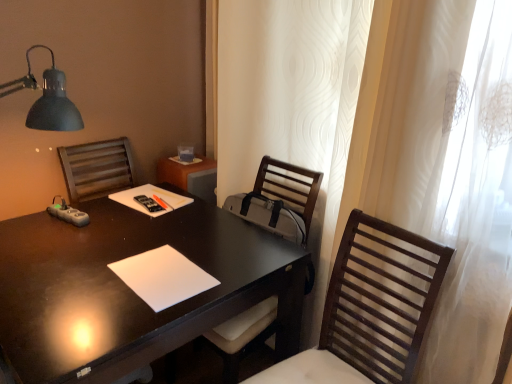
Question: From a real-world perspective, is wooden chair at center, positioned as the 2th chair in front-to-back order, above or below wooden slats chair at right, marked as the first chair in a front-to-back arrangement?

Choices:
 (A) above
 (B) below

Answer: (B)

Question: From the image's perspective, is wooden chair at center, positioned as the 2th chair in front-to-back order, located above or below wooden slats chair at right, which is the 2th chair in back-to-front order?

Choices:
 (A) above
 (B) below

Answer: (A)

Question: Which object is positioned closest to the wooden slats chair at right, which is the 2th chair in back-to-front order?

Choices:
 (A) white sheer curtain at right
 (B) black glossy desk at center
 (C) white matte notepad at center
 (D) wooden chair at center, positioned as the 2th chair in front-to-back order
 (E) black plastic remote control at center

Answer: (A)

Question: Estimate the real-world distances between objects in this image. Which object is closer to the wooden chair at center, which ranks as the first chair in back-to-front order?

Choices:
 (A) black plastic remote control at center
 (B) white matte notepad at center
 (C) black glossy desk at center
 (D) wooden slats chair at right, marked as the first chair in a front-to-back arrangement
 (E) white sheer curtain at right

Answer: (C)